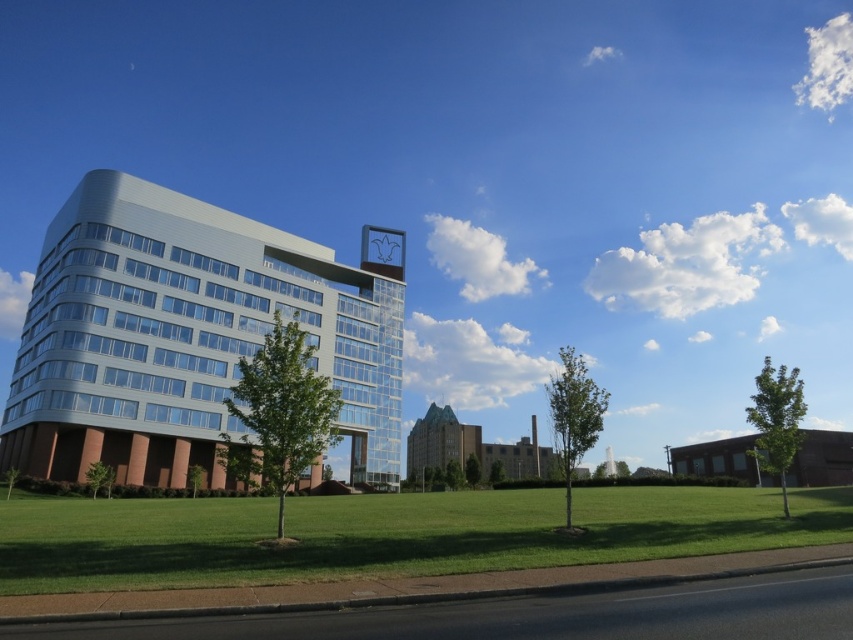
You are standing on the green grass at lower center and want to walk towards the metallic glass building at center. Is the building directly in front of you, or do you need to walk around any obstacles?

The metallic glass building at center is positioned over green grass at lower center, so the building is directly in front of you and there are no obstacles blocking your path.

Based on the photo, you are standing at point 0.0, 0.0 in the scene. The metallic glass building at center is located at coordinates 0.523, 0.223. If you want to walk directly towards it, which direction should you head?

You should head towards the coordinates (189, 333), which is northeast of your current position at (0, 0).

You are standing at the entrance of the modern building and want to take a photo of both the point at coordinates point (154, 296) and point (352, 554). Which point should you focus on first to ensure both are in the frame?

You should focus on point (154, 296) first because it is closer to you than point (352, 554), ensuring both points remain within the camera frame.